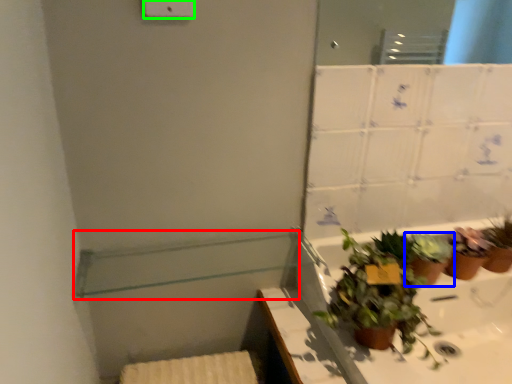
Question: Which object is the farthest from balustrade (highlighted by a red box)? Choose among these: houseplant (highlighted by a blue box) or light switch (highlighted by a green box).

Choices:
 (A) houseplant
 (B) light switch

Answer: (B)